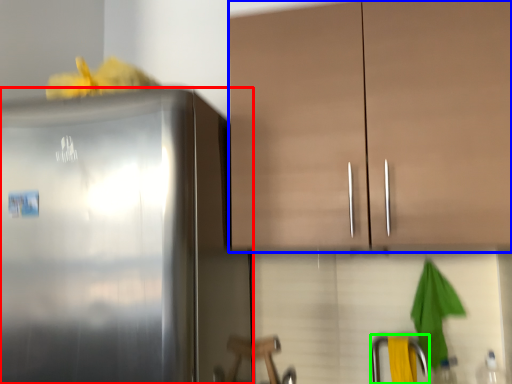
Question: Which object is positioned farthest from refrigerator (highlighted by a red box)? Select from cabinetry (highlighted by a blue box) and faucet (highlighted by a green box).

Choices:
 (A) cabinetry
 (B) faucet

Answer: (B)